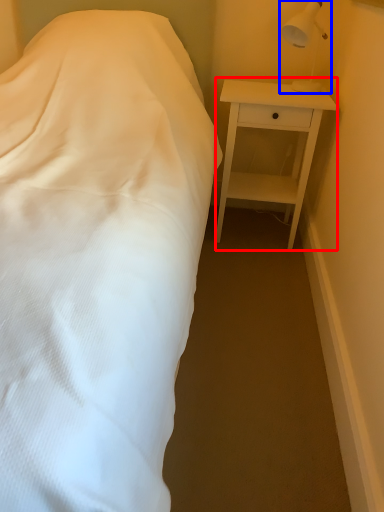
Question: Among these objects, which one is farthest to the camera, nightstand (highlighted by a red box) or lamp (highlighted by a blue box)?

Choices:
 (A) nightstand
 (B) lamp

Answer: (A)